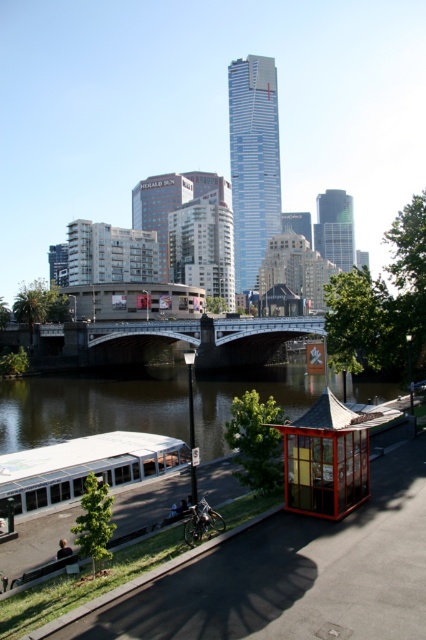
From the picture: Does brown water at lower center appear on the right side of white matte boat at lower left?

Yes, brown water at lower center is to the right of white matte boat at lower left.

This screenshot has height=640, width=426. What do you see at coordinates (92, 406) in the screenshot?
I see `brown water at lower center` at bounding box center [92, 406].

I want to click on brown water at lower center, so click(x=92, y=406).

Between brown water at lower center and metallic gray bridge at center, which one appears on the left side from the viewer's perspective?

metallic gray bridge at center

From the picture: Who is positioned more to the right, brown water at lower center or metallic gray bridge at center?

brown water at lower center is more to the right.

Is point (54, 417) positioned before point (9, 336)?

Yes.

In order to click on brown water at lower center in this screenshot , I will do `click(92, 406)`.

Does white matte boat at lower left lie behind wooden bus stop at center?

Yes, white matte boat at lower left is further from the viewer.

Identify the location of white matte boat at lower left. (83, 468).

Is point (114, 442) in front of point (322, 410)?

No, (114, 442) is further to viewer.

What are the coordinates of `white matte boat at lower left` in the screenshot? It's located at (83, 468).